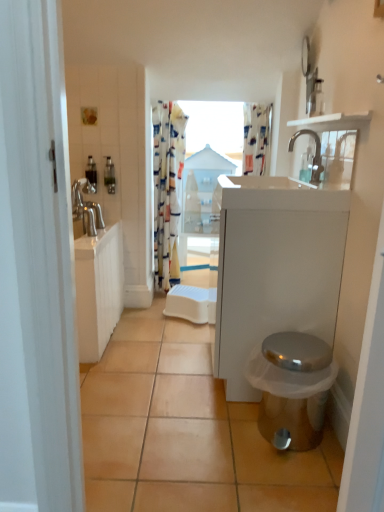
Question: Considering the relative positions of translucent plastic soap dispenser at left and patterned fabric shower curtain at upper center in the image provided, is translucent plastic soap dispenser at left to the left or to the right of patterned fabric shower curtain at upper center?

Choices:
 (A) left
 (B) right

Answer: (A)

Question: Considering their positions, is translucent plastic soap dispenser at left located in front of or behind patterned fabric shower curtain at upper center?

Choices:
 (A) front
 (B) behind

Answer: (A)

Question: Which of these objects is positioned farthest from the shiny metallic toilet at lower right?

Choices:
 (A) silver metallic faucet at upper center
 (B) patterned fabric shower curtain at upper center
 (C) matte white medicine cabinet at upper right
 (D) translucent plastic soap dispenser at left
 (E) orange matte tile at lower center

Answer: (D)

Question: Which is farther from the shiny metallic toilet at lower right?

Choices:
 (A) orange matte tile at lower center
 (B) white wood shelf at upper right
 (C) silver metallic faucet at upper center
 (D) matte white medicine cabinet at upper right
 (E) white glossy sink at upper center

Answer: (B)